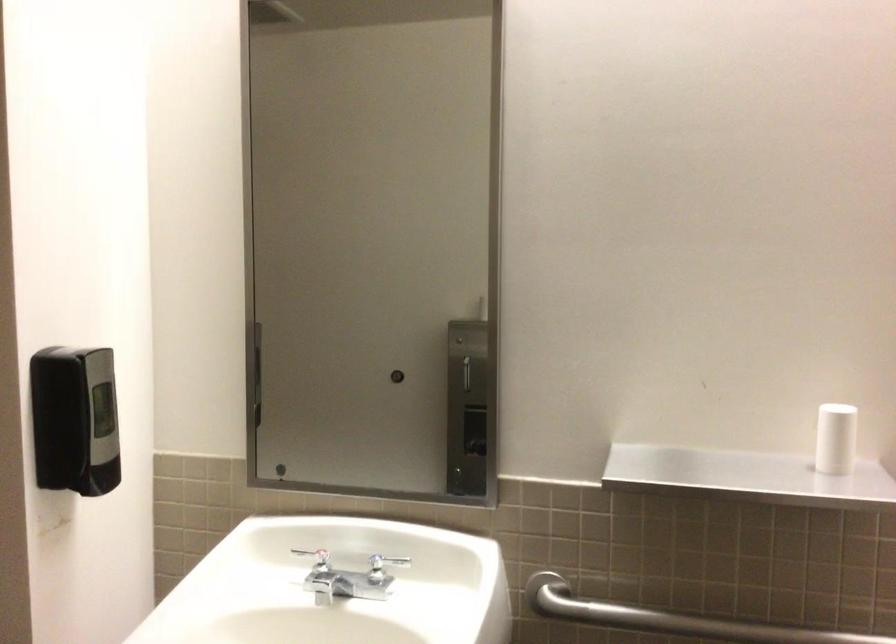
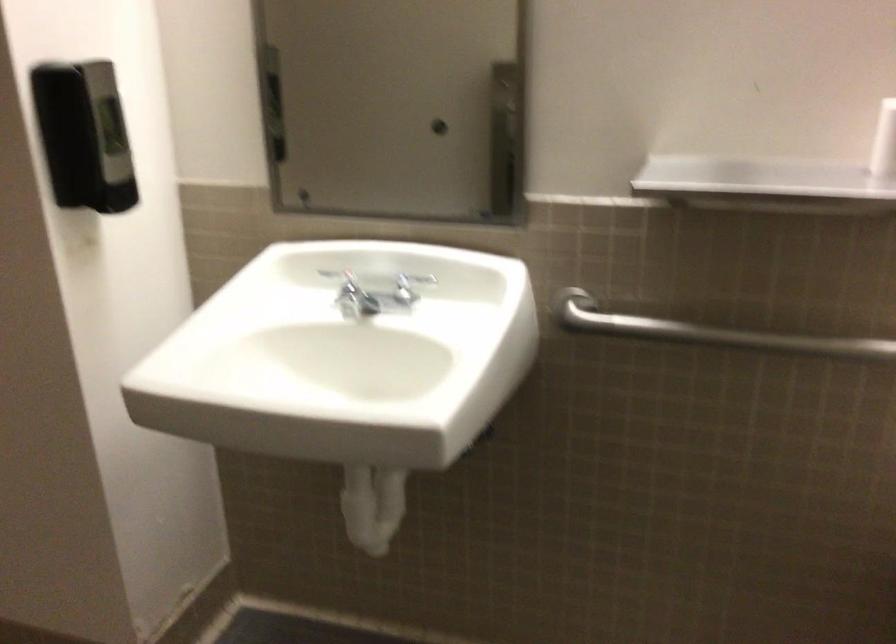
Find the pixel in the second image that matches (x=76, y=424) in the first image.

(83, 136)